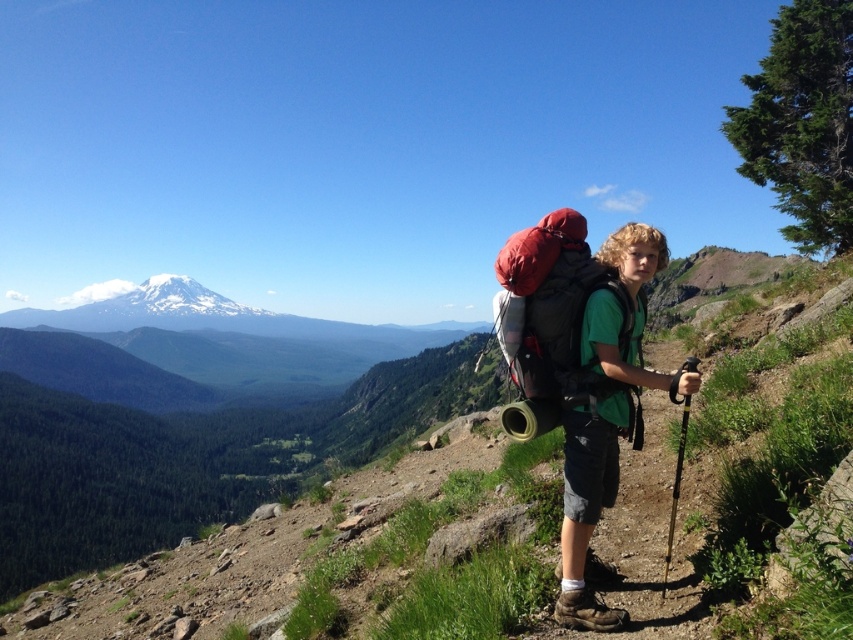
Based on the photo, can you confirm if green fabric backpack at center is thinner than matte red backpack at center?

Correct, green fabric backpack at center's width is less than matte red backpack at center's.

Which of these two, green fabric backpack at center or matte red backpack at center, stands shorter?

Standing shorter between the two is green fabric backpack at center.

Locate an element on the screen. green fabric backpack at center is located at coordinates (589, 509).